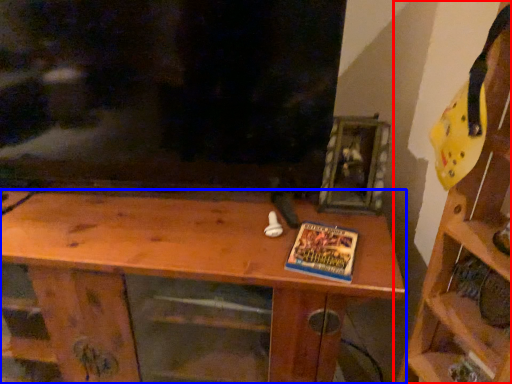
Question: Which object is further to the camera taking this photo, shelf (highlighted by a red box) or shelf (highlighted by a blue box)?

Choices:
 (A) shelf
 (B) shelf

Answer: (B)